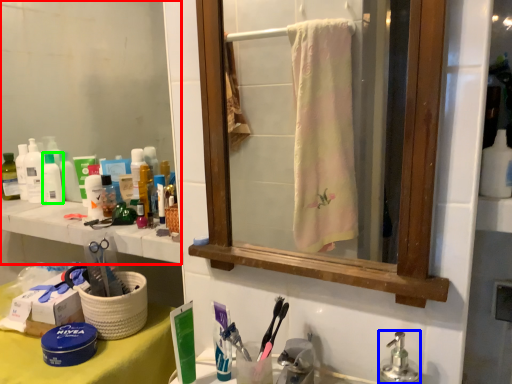
Question: Considering the real-world distances, which object is farthest from mirror (highlighted by a red box)? soap dispenser (highlighted by a blue box) or toiletry (highlighted by a green box)?

Choices:
 (A) soap dispenser
 (B) toiletry

Answer: (A)